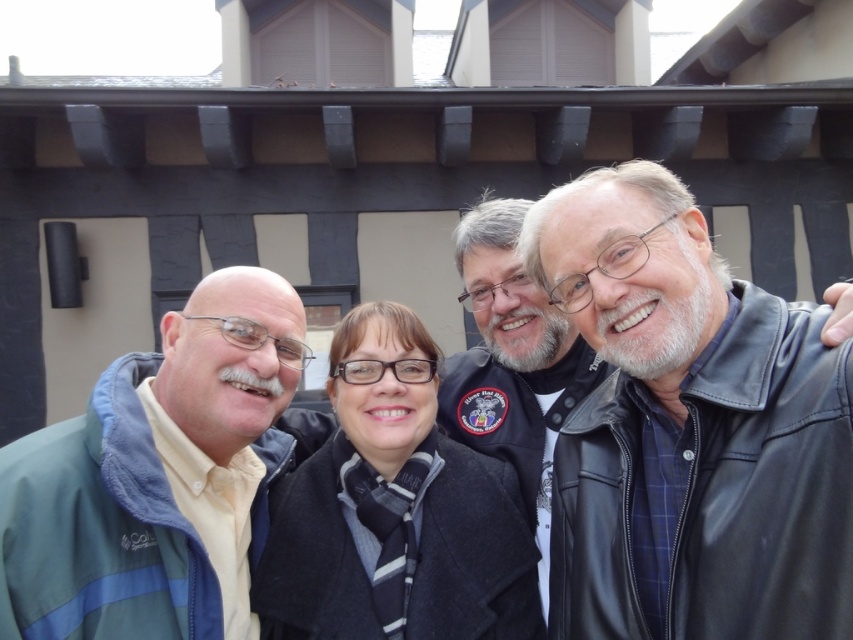
You are a photographer trying to adjust the lighting for the photo. You notice two coats at the center of the image. Which coat is closer to the camera, the dark gray wool coat at center or the black leather jacket at center?

The dark gray wool coat at center is positioned under the black leather jacket at center, so the black leather jacket at center is closer to the camera.

You are taking a photo of two points in the scene. The first point is at coordinate point (x=282, y=390) and the second is at point (x=335, y=436). Which point will appear larger in the photo?

Point (x=282, y=390) is closer to the camera than point (x=335, y=436), so it will appear larger in the photo.